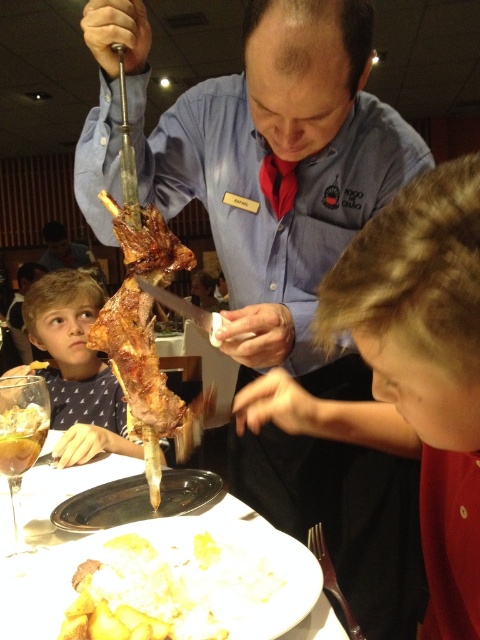
Question: Estimate the real-world distances between objects in this image. Which object is closer to the translucent glass at upper left?

Choices:
 (A) metallic silver fork at lower center
 (B) white glossy plate at center

Answer: (B)

Question: Can you confirm if polka dot shirt at lower left is bigger than translucent glass at upper left?

Choices:
 (A) yes
 (B) no

Answer: (A)

Question: Among these points, which one is farthest from the camera?

Choices:
 (A) (464, 186)
 (B) (322, 563)
 (C) (123, 408)

Answer: (C)

Question: Which point is farther to the camera?

Choices:
 (A) white glossy plate at center
 (B) white creamy mashed potatoes at lower center

Answer: (A)

Question: Is white glossy plate at center below translucent glass at upper left?

Choices:
 (A) no
 (B) yes

Answer: (B)

Question: Is white creamy mashed potatoes at lower center wider than metallic silver fork at lower center?

Choices:
 (A) no
 (B) yes

Answer: (B)